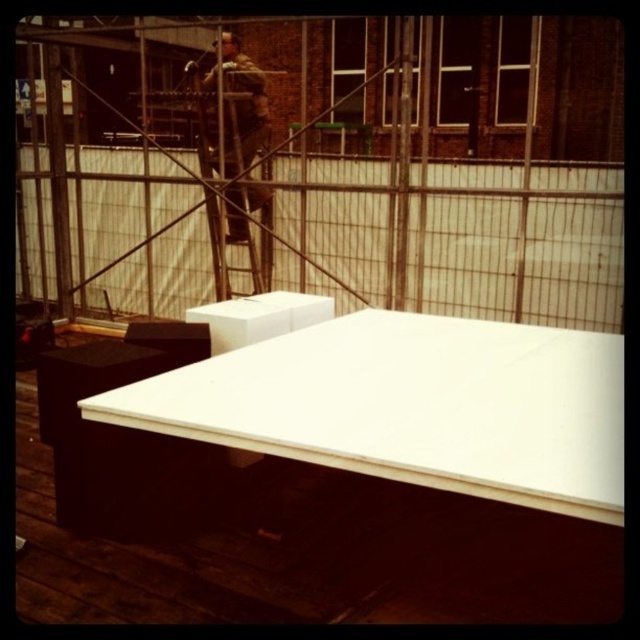
Question: Does white matte table at center have a larger size compared to metallic silver ladder at upper center?

Choices:
 (A) yes
 (B) no

Answer: (A)

Question: Does white matte table at center lie behind metallic silver ladder at upper center?

Choices:
 (A) no
 (B) yes

Answer: (A)

Question: Which of the following is the farthest from the observer?

Choices:
 (A) white matte table at center
 (B) metallic silver ladder at upper center

Answer: (B)

Question: Is white matte table at center below metallic silver ladder at upper center?

Choices:
 (A) no
 (B) yes

Answer: (B)

Question: Which object is closer to the camera taking this photo?

Choices:
 (A) white matte table at center
 (B) metallic silver ladder at upper center

Answer: (A)